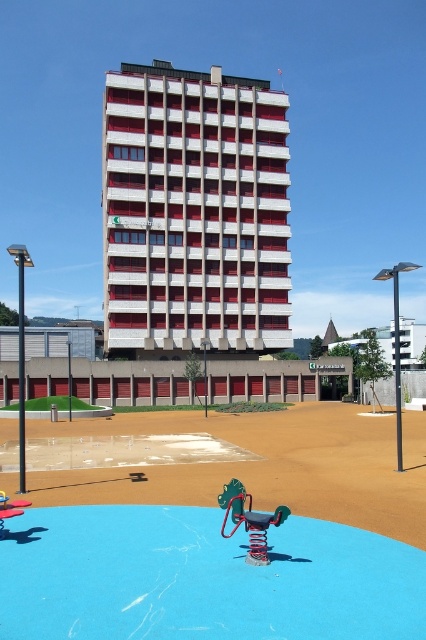
You are a parent trying to decide where to place a new toy box in the playground. The toy box is 2 meters wide. You see the metallic spring at center and the metallic blue swing at center. Which object should you place the toy box next to so it fits without overlapping?

The metallic spring at center might be wider than metallic blue swing at center. Therefore, placing the toy box next to the metallic blue swing at center would be safer to ensure it fits without overlapping.

You are planning to install a new swing set in the playground. The swing set requires a space that is wider than the metallic blue swing at center. Based on the scene, is there enough space next to the white concrete building at center to accommodate the new swing set?

The white concrete building at center might be wider than the metallic blue swing at center, so there may be sufficient space next to it for the new swing set.